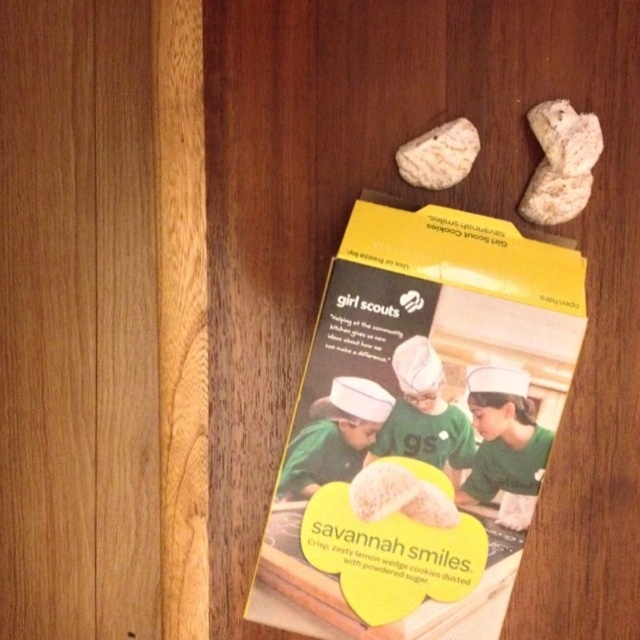
Question: Is the position of yellow paper girl scout cookie box at center less distant than that of white crumbly cookie at upper right?

Choices:
 (A) yes
 (B) no

Answer: (A)

Question: Estimate the real-world distances between objects in this image. Which object is closer to the white crumbly cookie at center?

Choices:
 (A) smooth beige rock at upper right
 (B) yellow paper girl scout cookie box at center
 (C) white crumbly cookie at upper right
 (D) baked white cookie at upper center

Answer: (B)

Question: Does white crumbly cookie at center come in front of white crumbly cookie at upper right?

Choices:
 (A) no
 (B) yes

Answer: (A)

Question: Can you confirm if baked white cookie at upper center is wider than smooth beige rock at upper right?

Choices:
 (A) yes
 (B) no

Answer: (A)

Question: Which of these objects is positioned closest to the white crumbly cookie at center?

Choices:
 (A) smooth beige rock at upper right
 (B) white crumbly cookie at upper right
 (C) baked white cookie at upper center

Answer: (A)

Question: Which object is closer to the camera taking this photo?

Choices:
 (A) white crumbly cookie at center
 (B) yellow paper girl scout cookie box at center

Answer: (B)